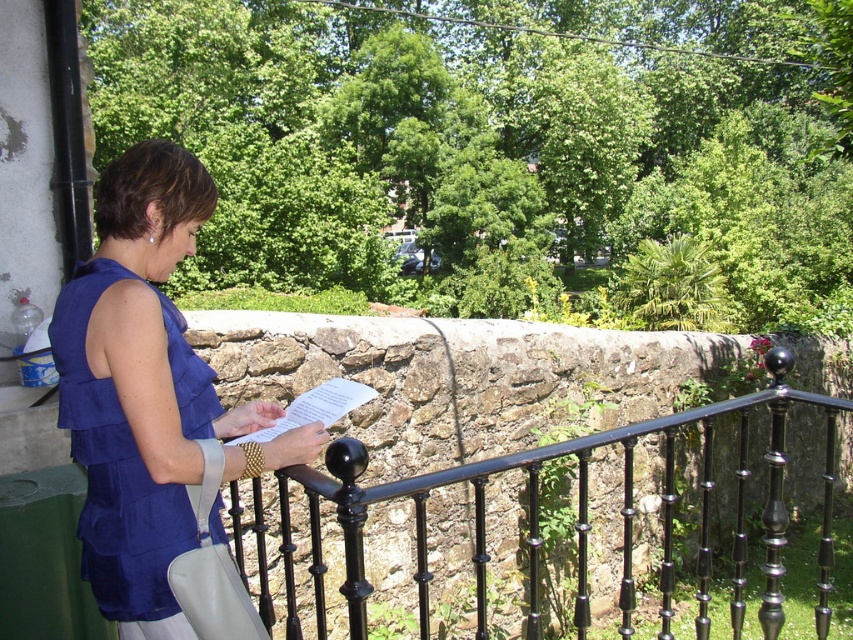
You are a delivery robot with a 50 cm wide package. You need to pass between the black wrought iron railing at center and the matte blue blouse at center. Can you fit through the space between them?

The distance between the black wrought iron railing at center and the matte blue blouse at center is 44.21 centimeters. Since your package is 50 cm wide, it is wider than the available space. You cannot fit through the space between them.

You are a photographer trying to capture the woman leaning against the black wrought iron railing at center and wearing the matte blue blouse at center. To ensure both the railing and the blouse are in focus, you need to know their relative positions. Which object is located to the right of the other?

The black wrought iron railing at center is positioned on the right side of the matte blue blouse at center, so the railing is to the right of the blouse.

You are a painter who wants to paint the black wrought iron railing at center and the matte blue blouse at center. Which object should you paint first if you want to start with the one that is shorter?

The black wrought iron railing at center has a lesser height compared to the matte blue blouse at center, so you should paint the black wrought iron railing at center first.